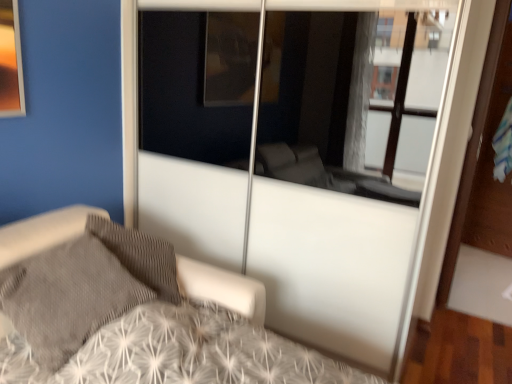
Question: From the image's perspective, is gray textured pillow at lower left over white textured bed at center?

Choices:
 (A) no
 (B) yes

Answer: (B)

Question: Is gray textured pillow at lower left in contact with white textured bed at center?

Choices:
 (A) yes
 (B) no

Answer: (B)

Question: Is gray textured pillow at lower left smaller than white textured bed at center?

Choices:
 (A) no
 (B) yes

Answer: (B)

Question: From a real-world perspective, is gray textured pillow at lower left located beneath white textured bed at center?

Choices:
 (A) yes
 (B) no

Answer: (B)

Question: Is gray textured pillow at lower left oriented towards white textured bed at center?

Choices:
 (A) no
 (B) yes

Answer: (B)

Question: Can you confirm if gray textured pillow at lower left is wider than white textured bed at center?

Choices:
 (A) no
 (B) yes

Answer: (A)

Question: Is white textured bed at center not close to gray textured pillow at lower left?

Choices:
 (A) yes
 (B) no

Answer: (B)

Question: Is white textured bed at center not within gray textured pillow at lower left?

Choices:
 (A) yes
 (B) no

Answer: (A)

Question: Is white textured bed at center in contact with gray textured pillow at lower left?

Choices:
 (A) yes
 (B) no

Answer: (B)

Question: Is white textured bed at center oriented away from gray textured pillow at lower left?

Choices:
 (A) yes
 (B) no

Answer: (A)

Question: Does white textured bed at center have a greater width compared to gray textured pillow at lower left?

Choices:
 (A) no
 (B) yes

Answer: (B)

Question: Does white textured bed at center appear on the left side of gray textured pillow at lower left?

Choices:
 (A) no
 (B) yes

Answer: (A)

Question: Is white textured bed at center inside or outside of gray textured pillow at lower left?

Choices:
 (A) inside
 (B) outside

Answer: (B)